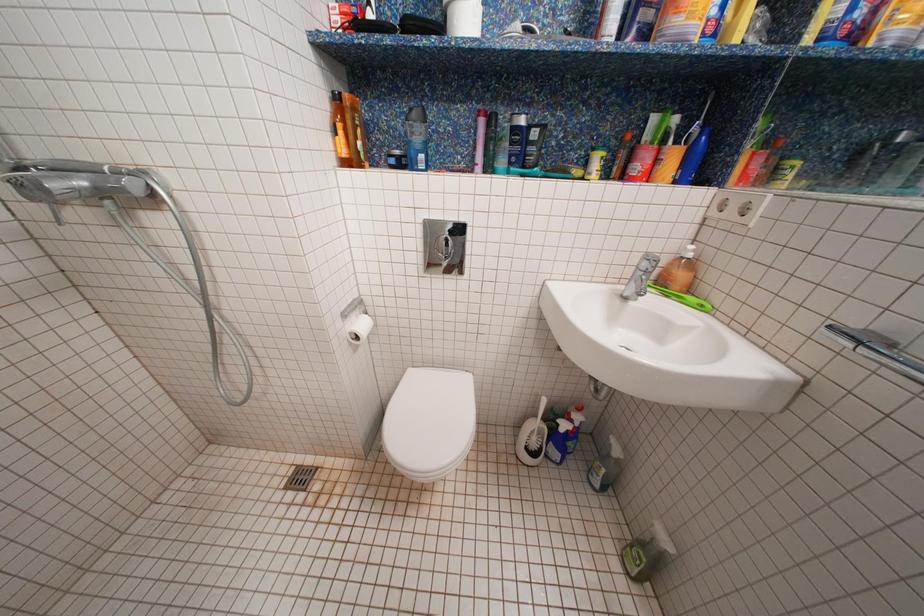
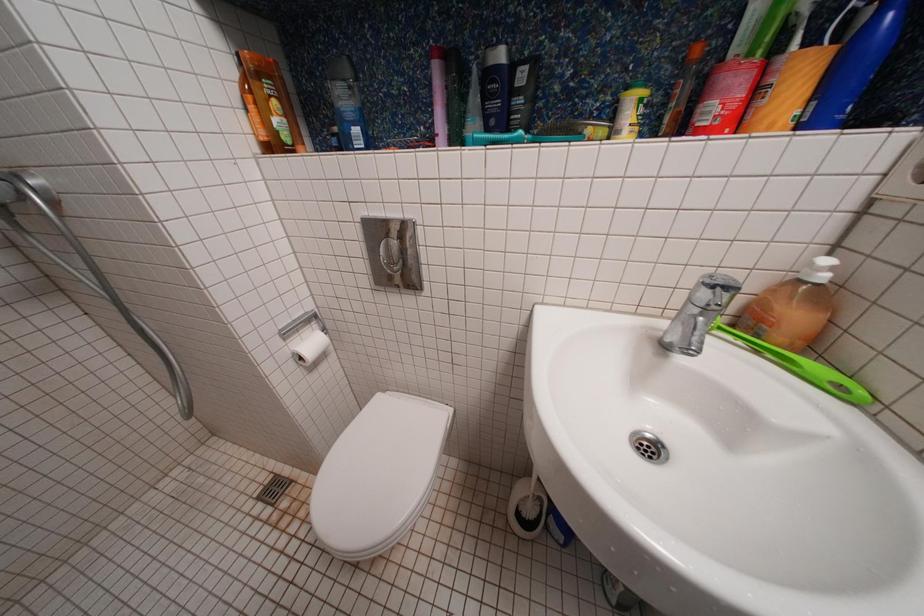
Question: Based on the continuous images, in which direction is the camera rotating? Reply with the corresponding letter.

Choices:
 (A) Left
 (B) Right
 (C) Up
 (D) Down

Answer: (A)